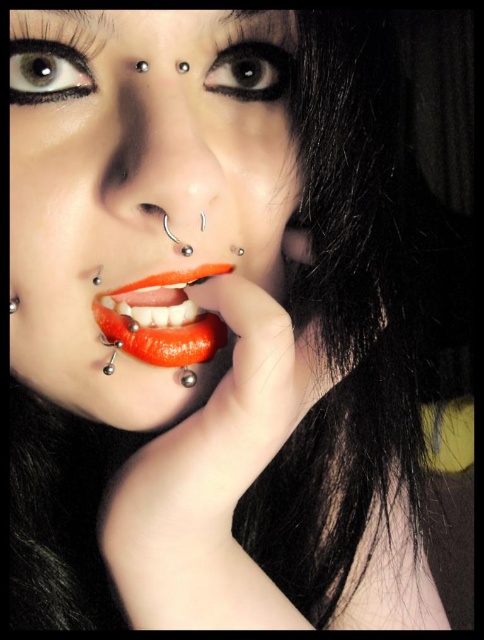
Which is above, black matte eye at upper center or silver metallic stud at lower left?

black matte eye at upper center is higher up.

The image size is (484, 640). I want to click on black matte eye at upper center, so pyautogui.click(x=251, y=72).

Is point (230, 29) positioned behind point (105, 372)?

No.

Find the location of a particular element. This screenshot has width=484, height=640. black matte eyebrow at upper center is located at coordinates (259, 28).

Locate an element on the screen. The width and height of the screenshot is (484, 640). black matte eyebrow at upper center is located at coordinates (259, 28).

Is shiny orange lips at center below silver metallic stud at lower left?

Incorrect, shiny orange lips at center is not positioned below silver metallic stud at lower left.

Who is more forward, (x=49, y=308) or (x=118, y=339)?

Point (x=49, y=308)

The image size is (484, 640). What do you see at coordinates (136, 214) in the screenshot?
I see `shiny orange lips at center` at bounding box center [136, 214].

You are a GUI agent. You are given a task and a screenshot of the screen. Output one action in this format:
    pyautogui.click(x=<x>, y=<y>)
    Task: Click on the shiny orange lips at center
    This screenshot has height=640, width=484.
    Given the screenshot: What is the action you would take?
    pyautogui.click(x=136, y=214)